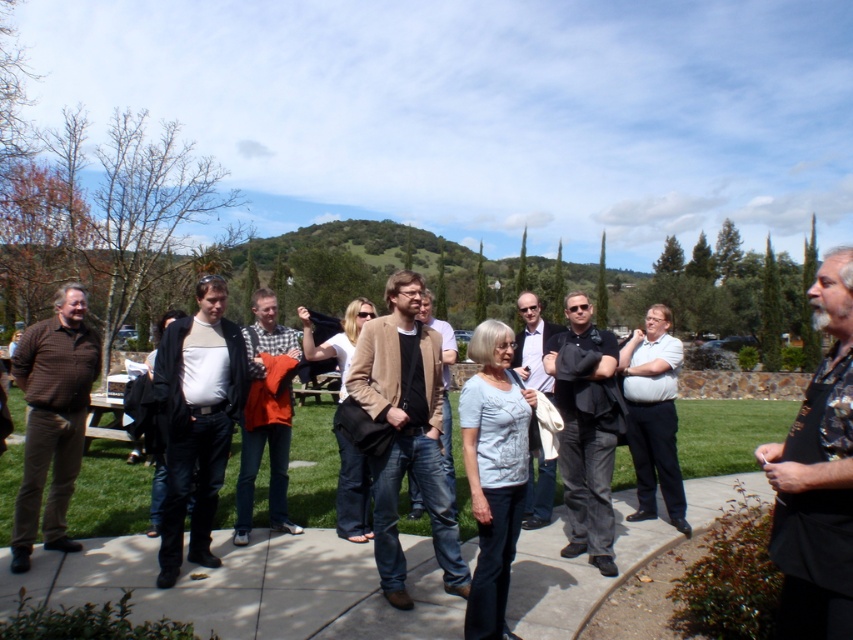
Is orange fabric at center closer to camera compared to tan leather jacket at center?

No.

Which of these two, orange fabric at center or tan leather jacket at center, stands taller?

orange fabric at center

What do you see at coordinates (265, 417) in the screenshot? The image size is (853, 640). I see `orange fabric at center` at bounding box center [265, 417].

Identify the location of orange fabric at center. The height and width of the screenshot is (640, 853). (265, 417).

Does light blue shirt at center appear on the left side of light brown leather jacket at center?

No, light blue shirt at center is not to the left of light brown leather jacket at center.

Between point (532, 484) and point (408, 476), which one is positioned in front?

Point (532, 484) is more forward.

This screenshot has height=640, width=853. Describe the element at coordinates (532, 342) in the screenshot. I see `light blue shirt at center` at that location.

Image resolution: width=853 pixels, height=640 pixels. What are the coordinates of `light blue shirt at center` in the screenshot? It's located at (532, 342).

Which is in front, point (573, 625) or point (85, 449)?

Point (573, 625) is in front.

Identify the location of gray concrete pavement at center. This screenshot has width=853, height=640. (252, 588).

In order to click on gray concrete pavement at center in this screenshot , I will do `click(252, 588)`.